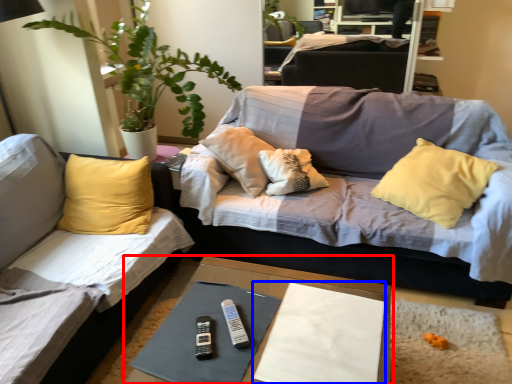
Question: Among these objects, which one is nearest to the camera, table (highlighted by a red box) or sheet (highlighted by a blue box)?

Choices:
 (A) table
 (B) sheet

Answer: (A)